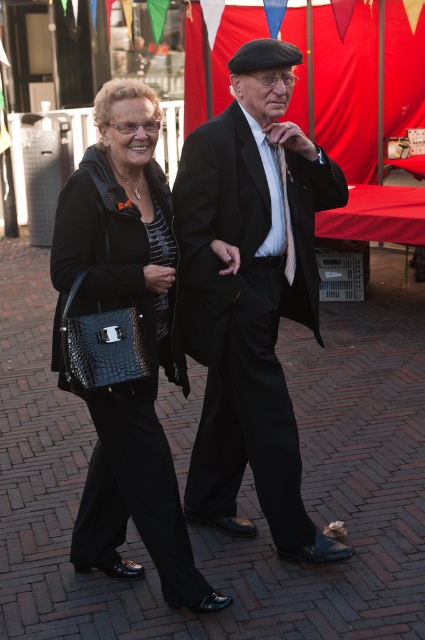
Is black matte suit at center bigger than striped silk tie at center?

Yes.

Who is positioned more to the right, black matte suit at center or striped silk tie at center?

Positioned to the right is striped silk tie at center.

At what (x,y) coordinates should I click in order to perform the action: click on black matte suit at center. Please return your answer as a coordinate pair (x, y). The height and width of the screenshot is (640, 425). Looking at the image, I should click on (252, 292).

Does black matte suit at center have a greater height compared to black crocodile-patterned handbag at center-left?

Yes.

Which is behind, point (248, 401) or point (122, 296)?

Point (248, 401)

The width and height of the screenshot is (425, 640). What are the coordinates of `black matte suit at center` in the screenshot? It's located at (252, 292).

Is brick pavement at center positioned behind black matte suit at center?

No.

Where is `brick pavement at center`? This screenshot has height=640, width=425. brick pavement at center is located at coordinates (241, 483).